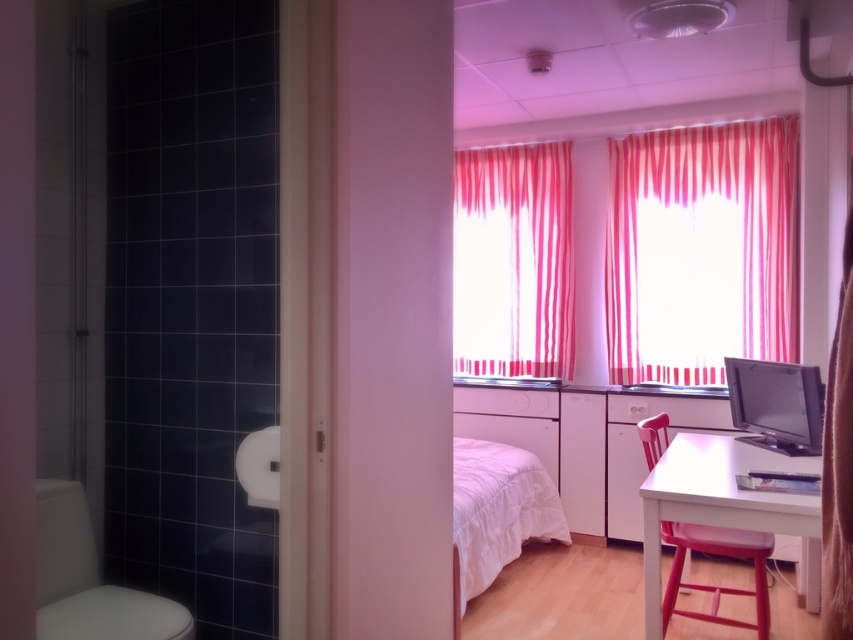
Is point (691, 440) behind point (807, 365)?

Yes, it is.

Is point (804, 561) farther from viewer compared to point (805, 401)?

Yes, point (804, 561) is behind point (805, 401).

Locate an element on the screen. The image size is (853, 640). white glossy table at lower right is located at coordinates (723, 504).

Does pink striped curtain at center have a lesser height compared to white glossy toilet bowl at lower left?

No.

Who is more forward, (496,282) or (88,580)?

Point (88,580) is more forward.

At what (x,y) coordinates should I click in order to perform the action: click on pink striped curtain at center. Please return your answer as a coordinate pair (x, y). This screenshot has width=853, height=640. Looking at the image, I should click on pyautogui.click(x=514, y=259).

Is point (48, 515) positioned behind point (473, 516)?

No, (48, 515) is in front of (473, 516).

Is white glossy toilet bowl at lower left to the left of white soft bed at center from the viewer's perspective?

Yes, white glossy toilet bowl at lower left is to the left of white soft bed at center.

The image size is (853, 640). In order to click on white glossy toilet bowl at lower left in this screenshot , I will do tap(88, 579).